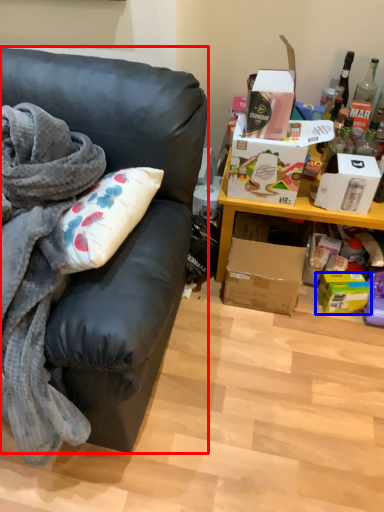
Question: Which point is closer to the camera, studio couch (highlighted by a red box) or box (highlighted by a blue box)?

Choices:
 (A) studio couch
 (B) box

Answer: (A)